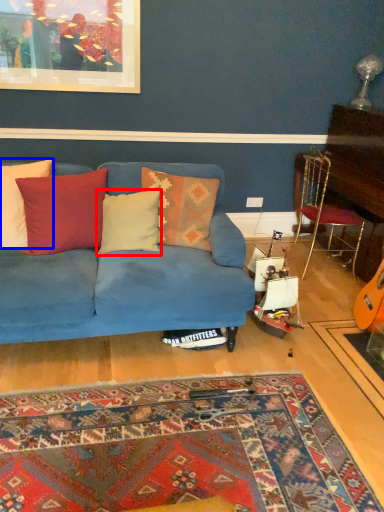
Question: Which point is closer to the camera, pillow (highlighted by a red box) or pillow (highlighted by a blue box)?

Choices:
 (A) pillow
 (B) pillow

Answer: (B)